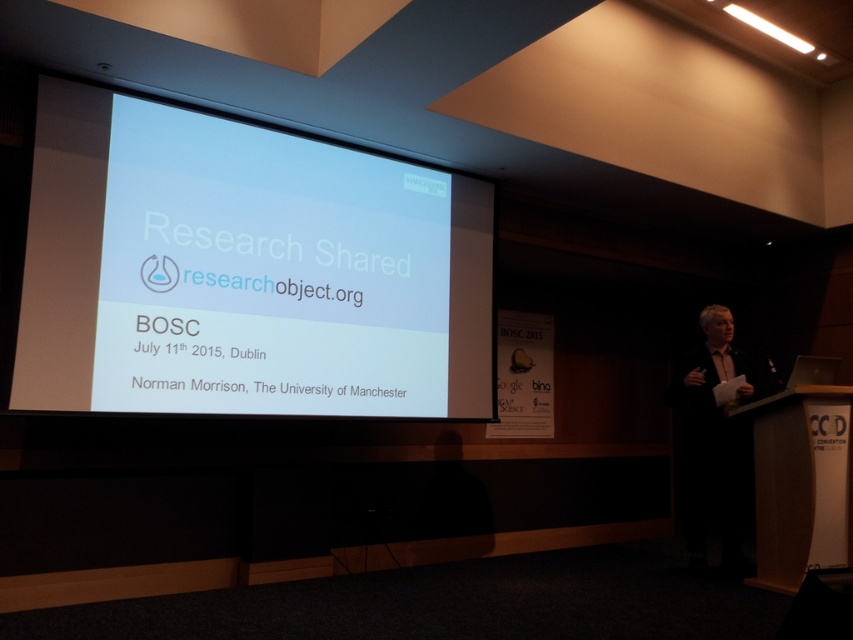
Question: Can you confirm if white glossy projection screen at upper left is positioned to the left of light brown leather jacket at right?

Choices:
 (A) no
 (B) yes

Answer: (B)

Question: Considering the relative positions of white glossy projection screen at upper left and light brown leather jacket at right in the image provided, where is white glossy projection screen at upper left located with respect to light brown leather jacket at right?

Choices:
 (A) left
 (B) right

Answer: (A)

Question: Which point is closer to the camera taking this photo?

Choices:
 (A) (431, 211)
 (B) (730, 368)

Answer: (A)

Question: Can you confirm if white glossy projection screen at upper left is smaller than light brown leather jacket at right?

Choices:
 (A) no
 (B) yes

Answer: (A)

Question: Among these points, which one is nearest to the camera?

Choices:
 (A) (700, 403)
 (B) (305, 400)

Answer: (B)